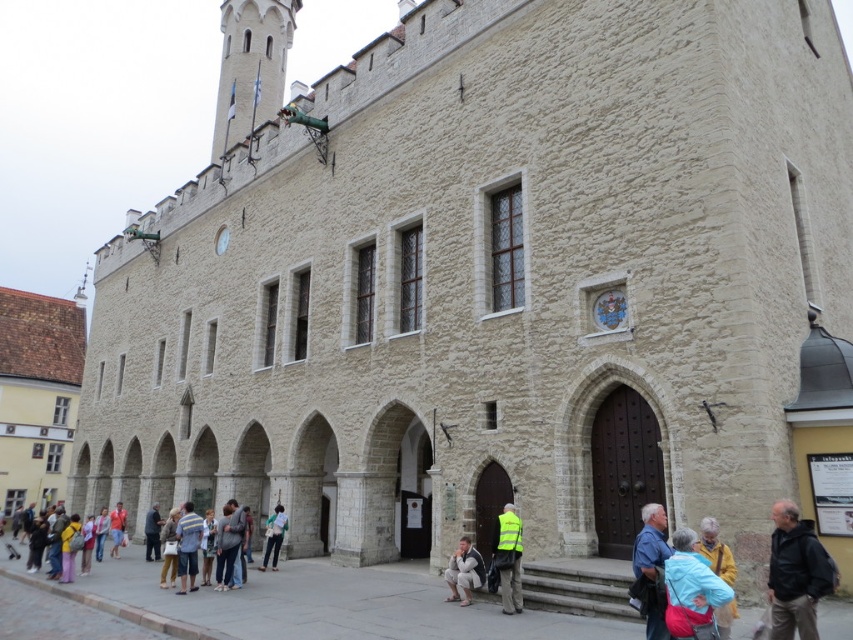
Can you confirm if brown stone church at left is wider than light blue fabric jacket at lower right?

Yes, brown stone church at left is wider than light blue fabric jacket at lower right.

How far apart are brown stone church at left and light blue fabric jacket at lower right?

The distance of brown stone church at left from light blue fabric jacket at lower right is 115.36 meters.

Who is more forward, [53,460] or [688,614]?

Point [688,614] is in front.

The width and height of the screenshot is (853, 640). Identify the location of brown stone church at left. (38, 394).

Can you confirm if light blue fabric jacket at lower right is shorter than striped shirt at lower center?

Correct, light blue fabric jacket at lower right is not as tall as striped shirt at lower center.

Does light blue fabric jacket at lower right come behind striped shirt at lower center?

No, light blue fabric jacket at lower right is closer to the viewer.

This screenshot has height=640, width=853. Find the location of `light blue fabric jacket at lower right`. light blue fabric jacket at lower right is located at coordinates (689, 586).

Who is more forward, (811, 538) or (158, 547)?

Positioned in front is point (811, 538).

Who is positioned more to the right, black fabric jacket at lower right or dark gray fabric pants at lower left?

From the viewer's perspective, black fabric jacket at lower right appears more on the right side.

This screenshot has height=640, width=853. Find the location of `black fabric jacket at lower right`. black fabric jacket at lower right is located at coordinates (795, 573).

You are a GUI agent. You are given a task and a screenshot of the screen. Output one action in this format:
    pyautogui.click(x=<x>, y=<y>)
    Task: Click on the black fabric jacket at lower right
    
    Given the screenshot: What is the action you would take?
    pyautogui.click(x=795, y=573)